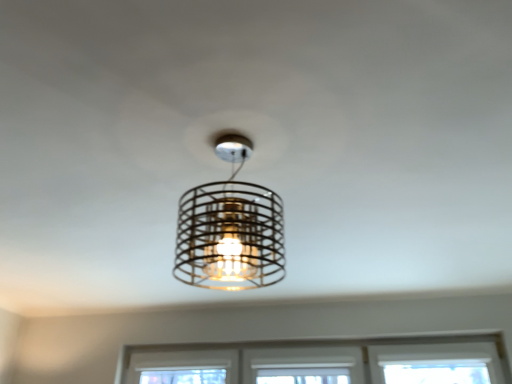
Question: Does clear glass window at center have a larger size compared to metallic wire cage at center?

Choices:
 (A) no
 (B) yes

Answer: (B)

Question: Can you confirm if clear glass window at center is taller than metallic wire cage at center?

Choices:
 (A) no
 (B) yes

Answer: (A)

Question: Considering the relative positions of clear glass window at center and metallic wire cage at center in the image provided, is clear glass window at center behind metallic wire cage at center?

Choices:
 (A) yes
 (B) no

Answer: (A)

Question: Is clear glass window at center closer to camera compared to metallic wire cage at center?

Choices:
 (A) yes
 (B) no

Answer: (B)

Question: Is the surface of clear glass window at center in direct contact with metallic wire cage at center?

Choices:
 (A) no
 (B) yes

Answer: (A)

Question: Are clear glass window at center and metallic wire cage at center far apart?

Choices:
 (A) no
 (B) yes

Answer: (B)

Question: Could you tell me if metallic wire cage at center is turned towards clear glass window at center?

Choices:
 (A) yes
 (B) no

Answer: (B)

Question: Is metallic wire cage at center wider than clear glass window at center?

Choices:
 (A) no
 (B) yes

Answer: (B)

Question: From a real-world perspective, does metallic wire cage at center stand above clear glass window at center?

Choices:
 (A) yes
 (B) no

Answer: (A)

Question: From the image's perspective, is metallic wire cage at center beneath clear glass window at center?

Choices:
 (A) yes
 (B) no

Answer: (B)

Question: Does metallic wire cage at center have a greater height compared to clear glass window at center?

Choices:
 (A) no
 (B) yes

Answer: (B)

Question: Considering the relative positions of metallic wire cage at center and clear glass window at center in the image provided, is metallic wire cage at center to the left of clear glass window at center from the viewer's perspective?

Choices:
 (A) yes
 (B) no

Answer: (A)

Question: From the image's perspective, is metallic wire cage at center above or below clear glass window at center?

Choices:
 (A) below
 (B) above

Answer: (B)